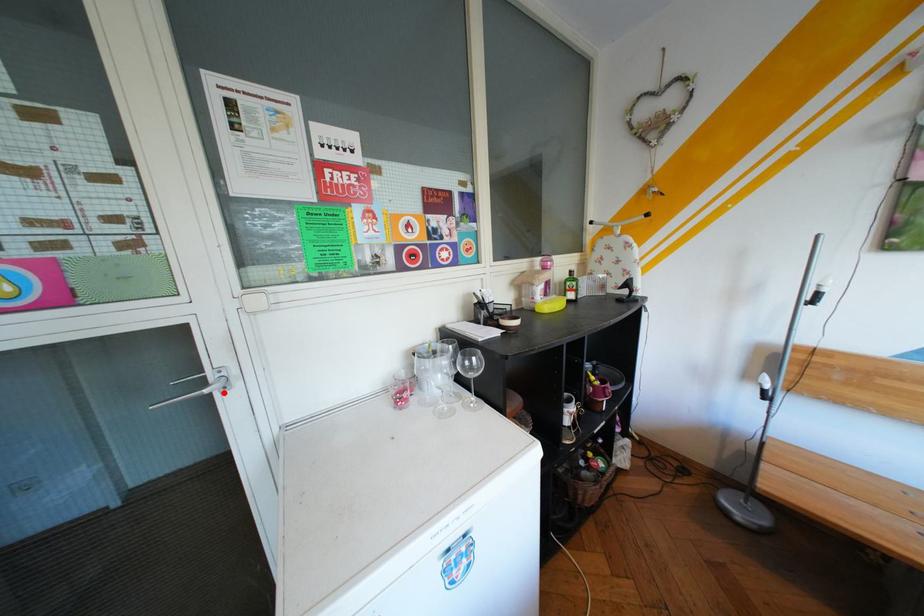
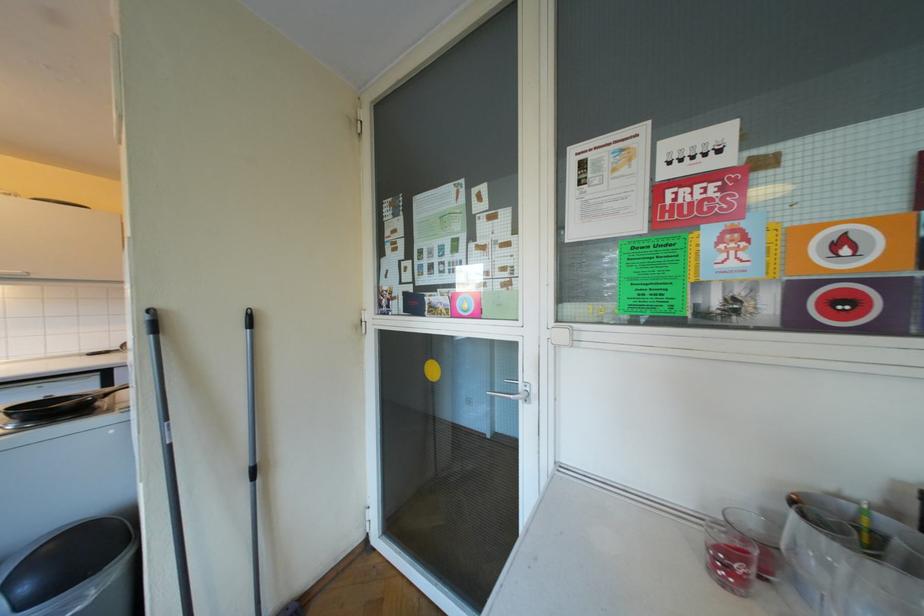
Where in the second image is the point corresponding to the highlighted location from the first image?

(529, 400)